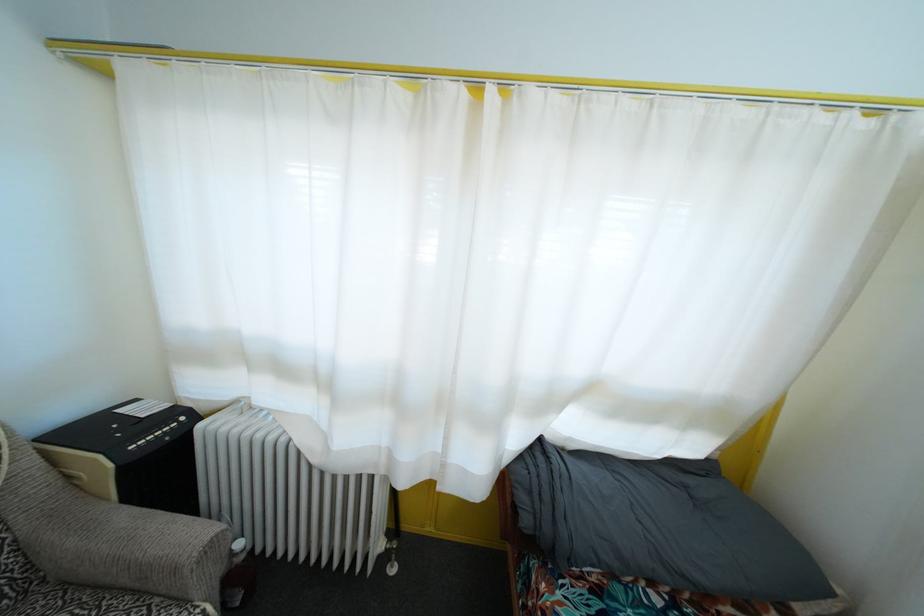
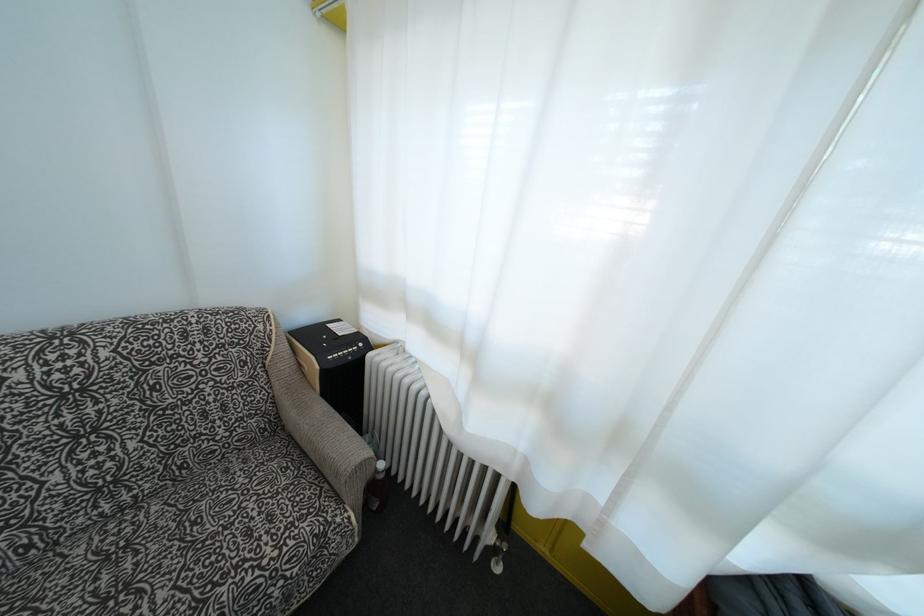
Question: The images are taken continuously from a first-person perspective. In which direction is your viewpoint rotating?

Choices:
 (A) Left
 (B) Right
 (C) Up
 (D) Down

Answer: (A)